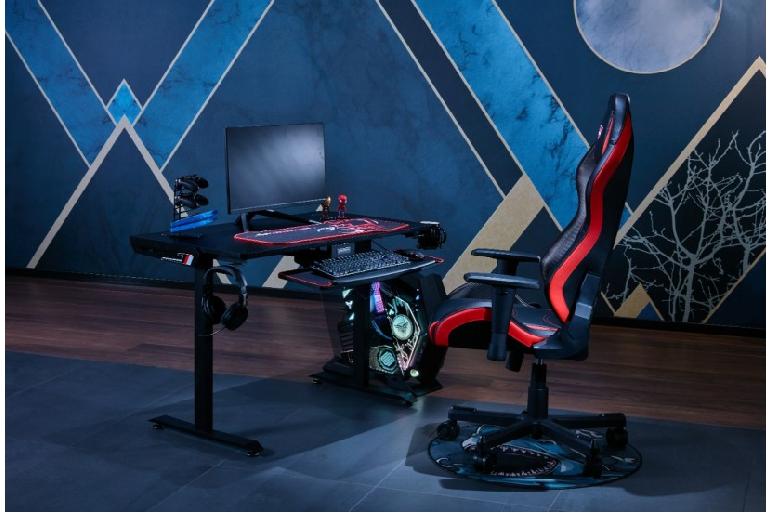
Where is `desk top area`? The width and height of the screenshot is (768, 512). desk top area is located at coordinates (237, 245).